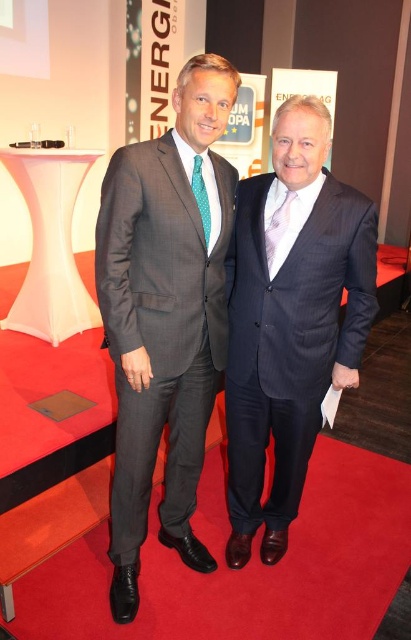
You are a fashion designer observing two men in suits at a formal event. You need to determine which suit is larger between the matte gray suit at center and the matte blue suit at center. Which one is bigger?

The matte gray suit at center is bigger than the matte blue suit at center.

You are a fashion designer analyzing the two suits worn by the men in the image. Which of the two suits, the matte gray suit at center or the matte blue suit at center, has a narrower silhouette?

The matte gray suit at center is thinner than the matte blue suit at center, so the matte gray suit at center has a narrower silhouette.

You are a photographer positioned in front of the two men wearing the matte gray suit at center and the matte blue suit at center. Which suit is higher in the image?

The matte gray suit at center is above the matte blue suit at center, so the matte gray suit at center is higher in the image.